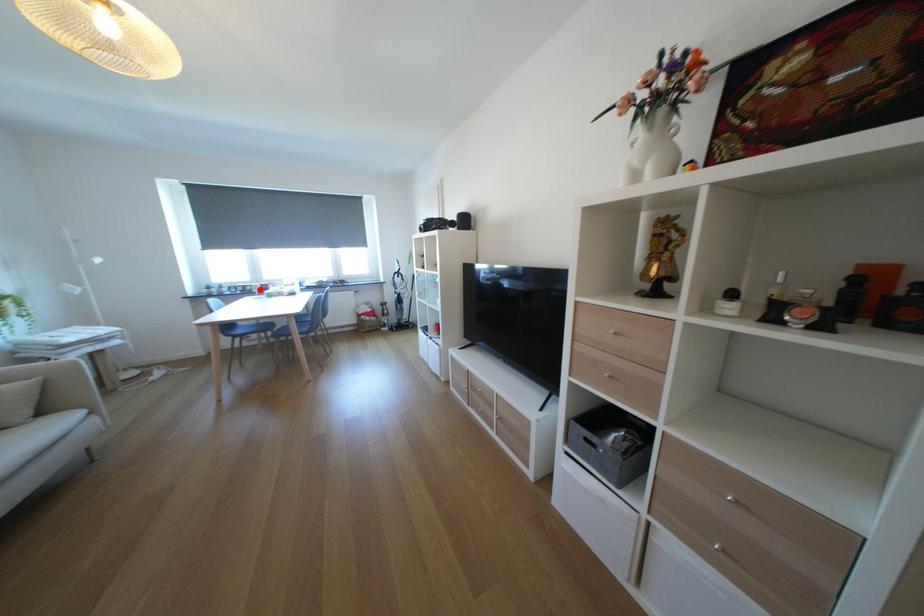
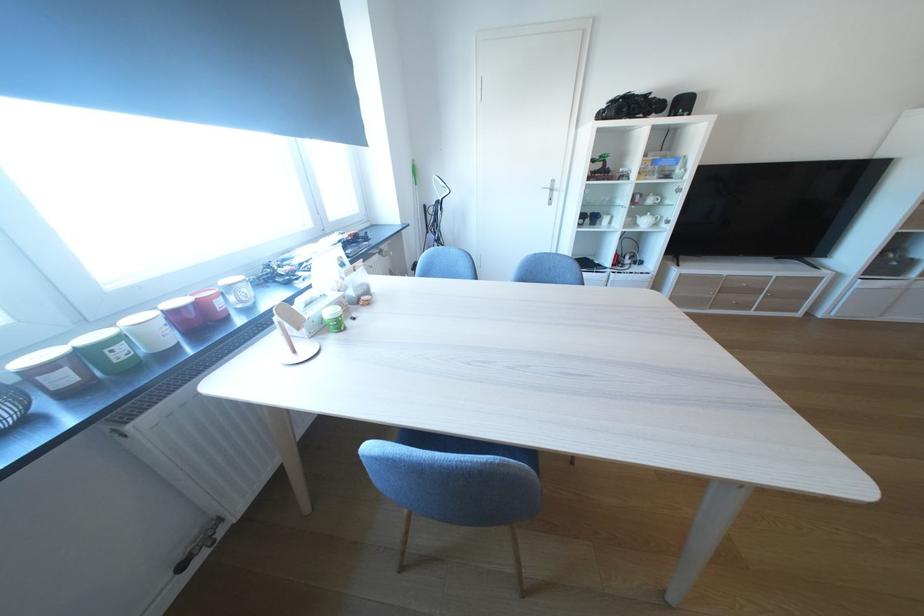
The point at the highlighted location is marked in the first image. Where is the corresponding point in the second image?

(129, 354)